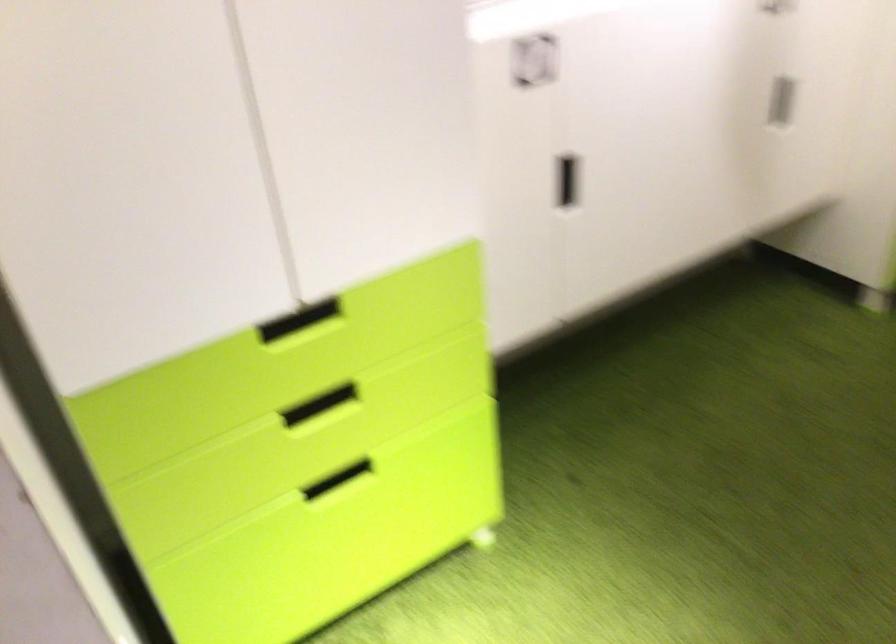
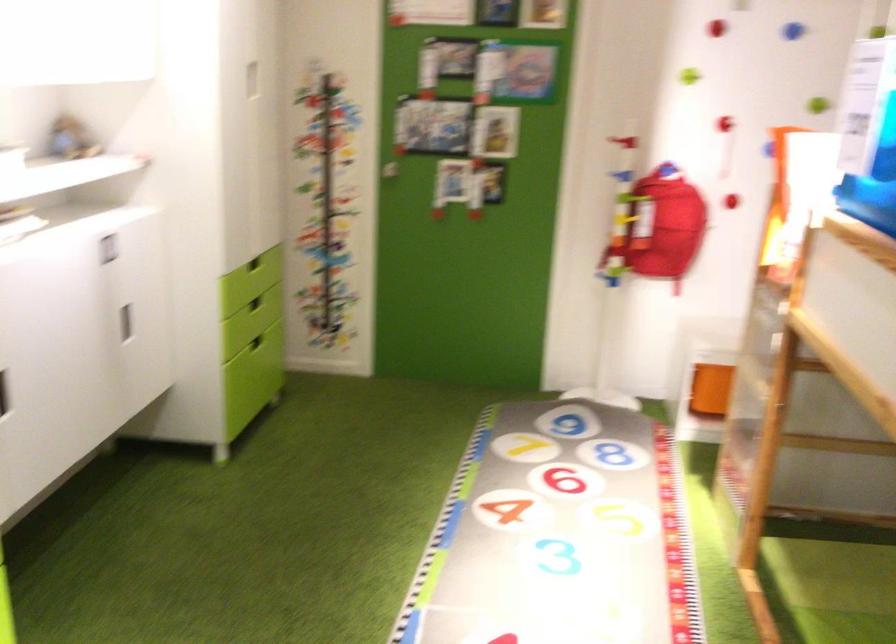
Question: How did the camera likely rotate?

Choices:
 (A) Left
 (B) Right
 (C) Up
 (D) Down

Answer: (B)